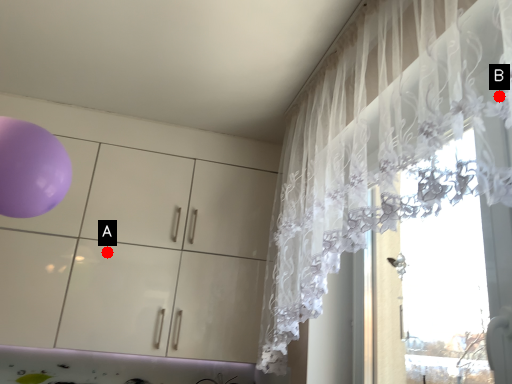
Question: Two points are circled on the image, labeled by A and B beside each circle. Which point is closer to the camera taking this photo?

Choices:
 (A) A is closer
 (B) B is closer

Answer: (B)